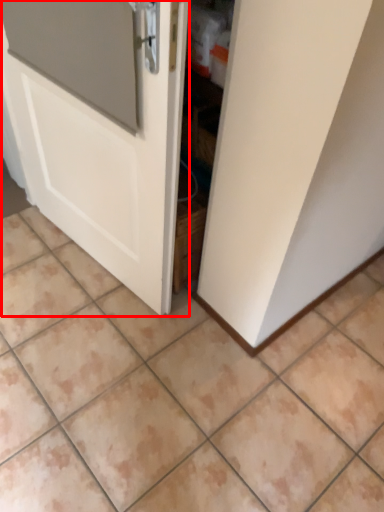
Question: From the image's perspective, what is the correct spatial positioning of door (annotated by the red box) in reference to ceramic tile?

Choices:
 (A) below
 (B) above

Answer: (B)